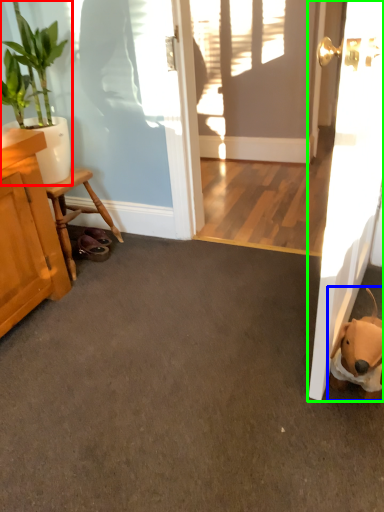
Question: Considering the real-world distances, which object is closest to houseplant (highlighted by a red box)? animal (highlighted by a blue box) or door (highlighted by a green box).

Choices:
 (A) animal
 (B) door

Answer: (B)